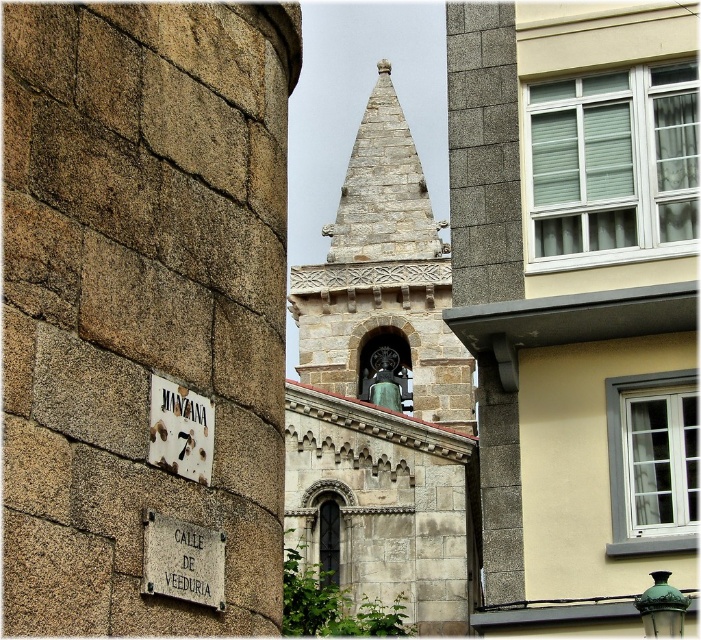
Question: Is gray stone church steeple at center below white stone sign at center?

Choices:
 (A) yes
 (B) no

Answer: (B)

Question: Is gray stone church at center below white metal sign at lower left?

Choices:
 (A) yes
 (B) no

Answer: (B)

Question: Among these objects, which one is farthest from the camera?

Choices:
 (A) white metal sign at lower left
 (B) gray stone church at center

Answer: (B)

Question: Can you confirm if stone textured spire at center is positioned below white metal sign at lower left?

Choices:
 (A) no
 (B) yes

Answer: (A)

Question: Which is farther from the white metal sign at lower left?

Choices:
 (A) white stone sign at center
 (B) gray stone church at center
 (C) stone textured spire at center
 (D) gray stone church steeple at center

Answer: (C)

Question: Which point is farther from the camera taking this photo?

Choices:
 (A) (193, 417)
 (B) (545, 292)
 (C) (447, 289)

Answer: (C)